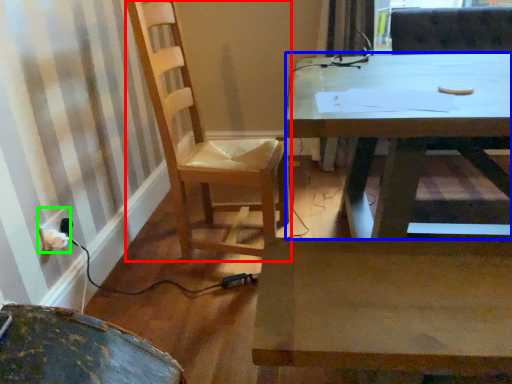
Question: Considering the real-world distances, which object is closest to chair (highlighted by a red box)? desk (highlighted by a blue box) or electric outlet (highlighted by a green box).

Choices:
 (A) desk
 (B) electric outlet

Answer: (A)